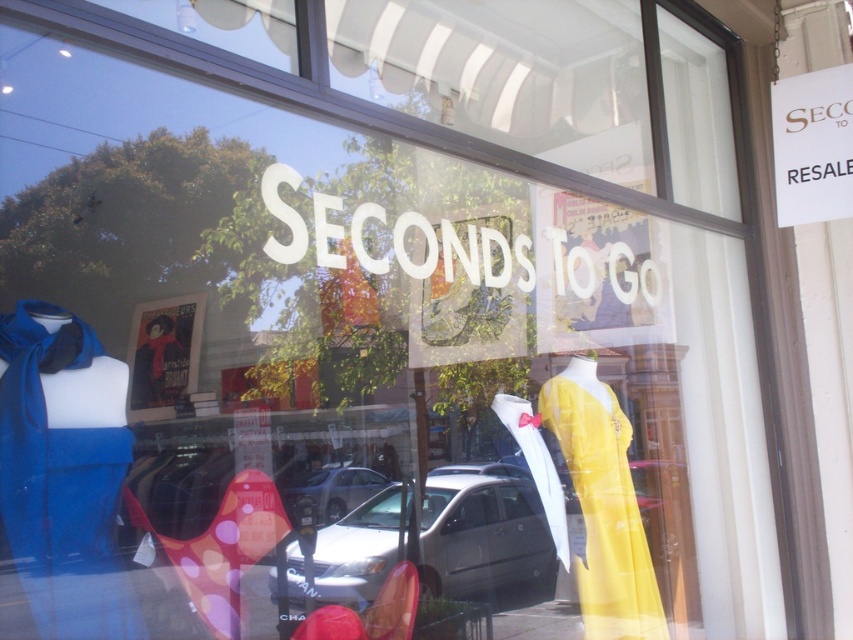
Question: Observing the image, what is the correct spatial positioning of silver metallic van at center in reference to silver metallic car at center?

Choices:
 (A) right
 (B) left

Answer: (A)

Question: Which object appears farthest from the camera in this image?

Choices:
 (A) silver metallic car at center
 (B) silver metallic van at center
 (C) yellow satin dress at center

Answer: (A)

Question: Which is farther from the silver metallic car at center?

Choices:
 (A) yellow satin dress at center
 (B) silver metallic van at center

Answer: (A)

Question: Does silver metallic van at center appear on the left side of silver metallic car at center?

Choices:
 (A) no
 (B) yes

Answer: (A)

Question: Does silver metallic van at center appear over yellow satin dress at center?

Choices:
 (A) no
 (B) yes

Answer: (A)

Question: Which point is farther to the camera?

Choices:
 (A) (578, 410)
 (B) (303, 488)
 (C) (335, 525)

Answer: (B)